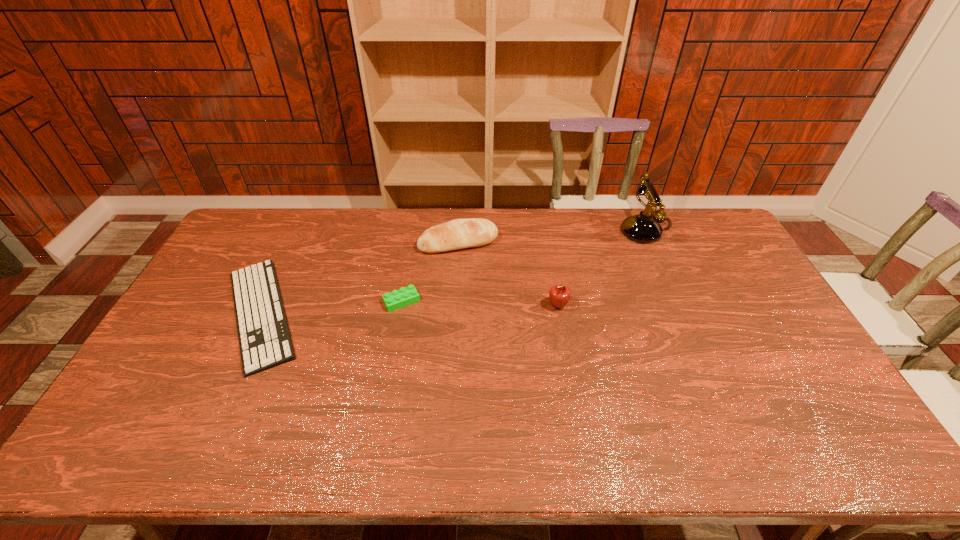
In the image, there is a desktop. Where is `vacant space at the far right corner`? This screenshot has width=960, height=540. vacant space at the far right corner is located at coordinates (714, 223).

Find the location of a particular element. vacant region between the Lego and the bread is located at coordinates (430, 272).

The image size is (960, 540). Identify the location of free spot between the rightmost object and the shortest object. (453, 272).

Identify the location of blank region between the shortest object and the telephone. (453, 272).

Where is `free space between the rightmost object and the fourth tallest object`? free space between the rightmost object and the fourth tallest object is located at coordinates (524, 266).

Where is `vacant region between the apple and the second shortest object`? The width and height of the screenshot is (960, 540). vacant region between the apple and the second shortest object is located at coordinates (480, 303).

The image size is (960, 540). Identify the location of free area in between the apple and the fourth tallest object. (480, 303).

Identify the location of free space between the second object from right to left and the telephone. This screenshot has width=960, height=540. (602, 268).

Find the location of a particular element. The height and width of the screenshot is (540, 960). vacant space that is in between the second object from right to left and the computer keyboard is located at coordinates (409, 310).

At what (x,y) coordinates should I click in order to perform the action: click on unoccupied area between the rightmost object and the bread. Please return your answer as a coordinate pair (x, y). Image resolution: width=960 pixels, height=540 pixels. Looking at the image, I should click on (552, 237).